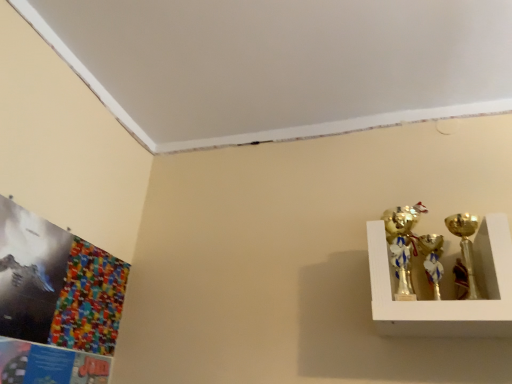
Question: From their relative heights in the image, would you say gold metallic candle holder at right, which ranks as the 1th candle holder in right-to-left order, is taller or shorter than gold metallic trophy at upper right, the 2th candle holder in the right-to-left sequence?

Choices:
 (A) tall
 (B) short

Answer: (A)

Question: From a real-world perspective, is gold metallic candle holder at right, which ranks as the 1th candle holder in right-to-left order, positioned above or below gold metallic trophy at upper right, the first candle holder positioned from the left?

Choices:
 (A) below
 (B) above

Answer: (A)

Question: In the image, is gold metallic candle holder at right, marked as the second candle holder in a left-to-right arrangement, positioned in front of or behind gold metallic trophy at upper right, the 2th candle holder in the right-to-left sequence?

Choices:
 (A) front
 (B) behind

Answer: (A)

Question: Looking at the image, does gold metallic trophy at upper right, the first candle holder positioned from the left, seem bigger or smaller compared to gold metallic candle holder at right, which ranks as the 1th candle holder in right-to-left order?

Choices:
 (A) small
 (B) big

Answer: (A)

Question: Would you say gold metallic trophy at upper right, the 2th candle holder in the right-to-left sequence, is to the left or to the right of gold metallic candle holder at right, which ranks as the 1th candle holder in right-to-left order, in the picture?

Choices:
 (A) left
 (B) right

Answer: (A)

Question: In terms of height, does gold metallic trophy at upper right, the 2th candle holder in the right-to-left sequence, look taller or shorter compared to gold metallic candle holder at right, marked as the second candle holder in a left-to-right arrangement?

Choices:
 (A) short
 (B) tall

Answer: (A)

Question: From a real-world perspective, is gold metallic trophy at upper right, the 2th candle holder in the right-to-left sequence, positioned above or below gold metallic candle holder at right, which ranks as the 1th candle holder in right-to-left order?

Choices:
 (A) below
 (B) above

Answer: (B)